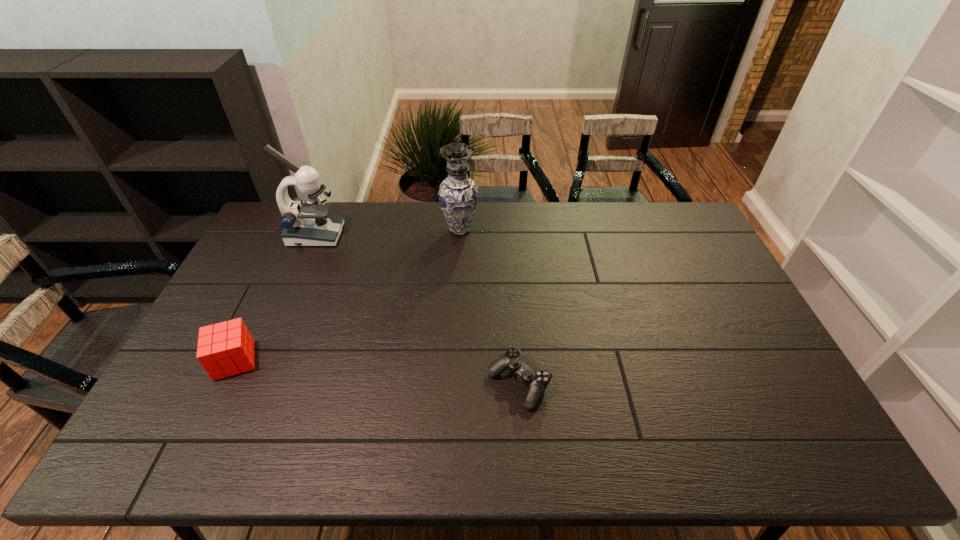
The width and height of the screenshot is (960, 540). Identify the location of microscope. (305, 223).

Locate an element on the screen. The height and width of the screenshot is (540, 960). vase is located at coordinates (458, 194).

Find the location of `cube`. cube is located at coordinates (227, 348).

You are a GUI agent. You are given a task and a screenshot of the screen. Output one action in this format:
    pyautogui.click(x=<x>, y=<y>)
    Task: Click on the shortest object
    The image size is (960, 540).
    Given the screenshot: What is the action you would take?
    pyautogui.click(x=532, y=374)

Locate an element on the screen. The image size is (960, 540). control is located at coordinates (532, 374).

What are the coordinates of `vacant space located at the eyepiece of the microscope` in the screenshot? It's located at (421, 235).

I want to click on vacant area located on the right of the vase, so click(x=582, y=230).

Locate an element on the screen. The image size is (960, 540). vacant space located on the front of the cube is located at coordinates (190, 451).

This screenshot has width=960, height=540. Identify the location of vacant point located on the back of the shortest object. (512, 288).

Locate an element on the screen. microscope located at the far edge is located at coordinates (305, 223).